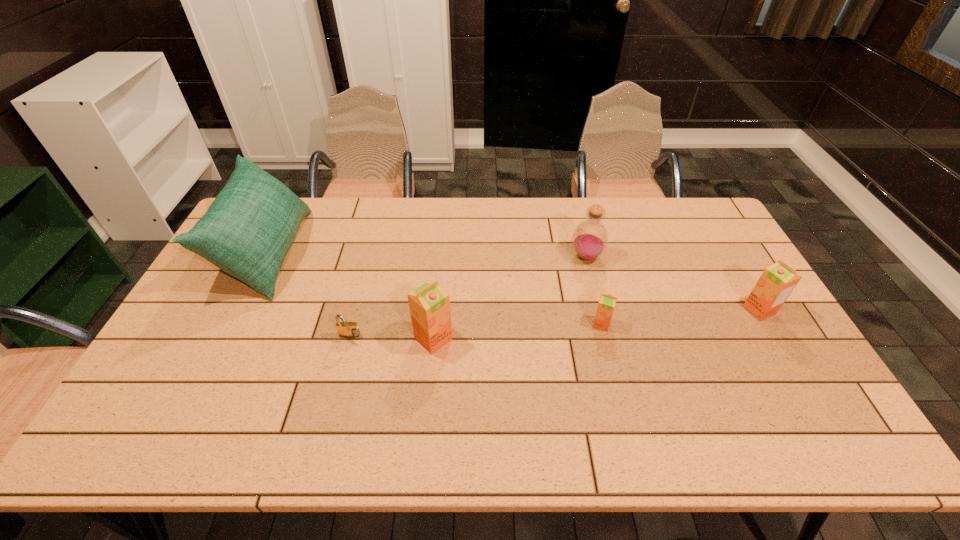
Identify the location of free spot that satisfies the following two spatial constraints: 1. on the back side of the second shortest orange juice; 2. on the front-facing side of the tallest object. (726, 253).

Where is `free spot that satisfies the following two spatial constraints: 1. on the back side of the third object from left to right; 2. on the left side of the shortest orange juice`? This screenshot has width=960, height=540. free spot that satisfies the following two spatial constraints: 1. on the back side of the third object from left to right; 2. on the left side of the shortest orange juice is located at coordinates (435, 324).